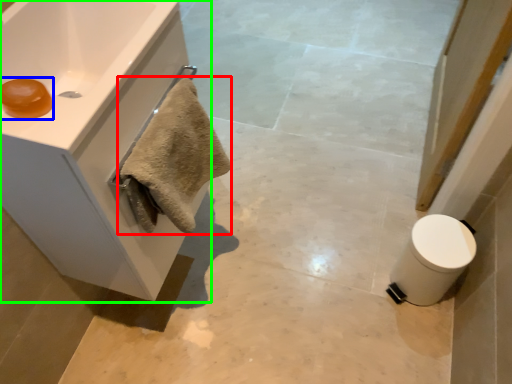
Question: Which is farther away from bath towel (highlighted by a red box)? soap (highlighted by a blue box) or bathroom cabinet (highlighted by a green box)?

Choices:
 (A) soap
 (B) bathroom cabinet

Answer: (A)